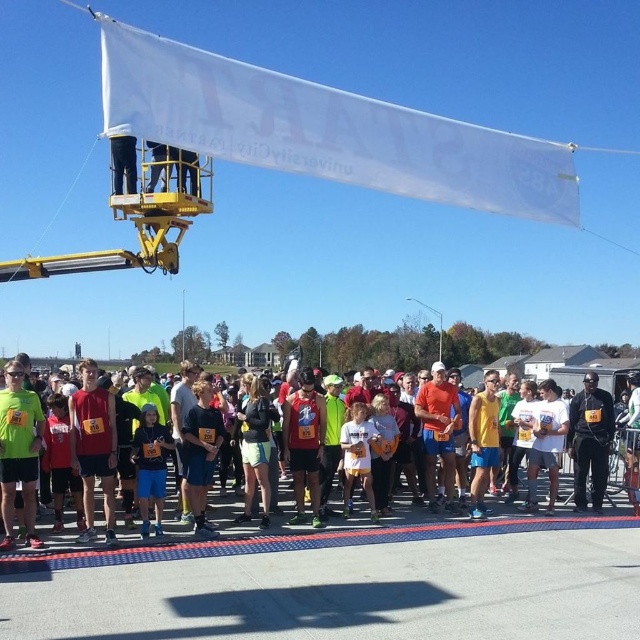
You are a photographer positioned at the starting line of a 5K race. You need to ensure that both the matte black shirt at center and the black matte pants at center are clearly visible in your photo. Given their positions, which one might you need to adjust your camera angle to better capture?

The matte black shirt at center is taller than the black matte pants at center. To ensure both are visible, you might need to adjust your camera angle to account for the height difference, possibly tilting the camera slightly upward to include the taller shirt while still capturing the pants.

You are a participant in the race and you see the point marked at coordinates (x=493, y=518). What is the color of the shirt at that point?

The point at coordinates (x=493, y=518) marks the matte black shirt at center.

You are a photographer at the event and want to take a photo of the matte black shirt at center and the black matte pants at center. Which object should you focus on first if you need to capture them from left to right?

The matte black shirt at center should be focused on first as it is positioned to the left of the black matte pants at center.